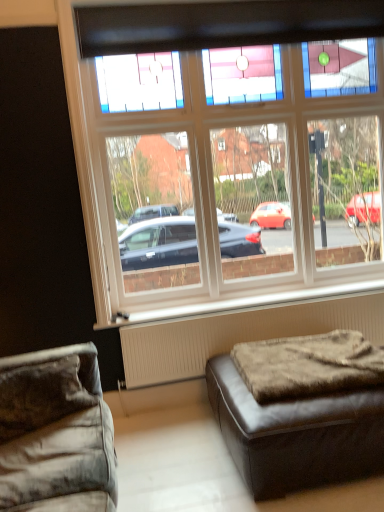
Question: Considering the relative sizes of brown fuzzy ottoman at lower right and brown leather ottoman at lower right, which ranks as the first studio couch in right-to-left order, in the image provided, is brown fuzzy ottoman at lower right smaller than brown leather ottoman at lower right, which ranks as the first studio couch in right-to-left order,?

Choices:
 (A) no
 (B) yes

Answer: (B)

Question: Considering the relative sizes of brown fuzzy ottoman at lower right and brown leather ottoman at lower right, the 2th studio couch in the left-to-right sequence, in the image provided, is brown fuzzy ottoman at lower right wider than brown leather ottoman at lower right, the 2th studio couch in the left-to-right sequence,?

Choices:
 (A) no
 (B) yes

Answer: (A)

Question: Is brown fuzzy ottoman at lower right closer to the viewer compared to brown leather ottoman at lower right, the 2th studio couch in the left-to-right sequence?

Choices:
 (A) no
 (B) yes

Answer: (A)

Question: Is brown fuzzy ottoman at lower right to the left of brown leather ottoman at lower right, which ranks as the first studio couch in right-to-left order, from the viewer's perspective?

Choices:
 (A) yes
 (B) no

Answer: (A)

Question: From a real-world perspective, is brown fuzzy ottoman at lower right on brown leather ottoman at lower right, which ranks as the first studio couch in right-to-left order?

Choices:
 (A) no
 (B) yes

Answer: (B)

Question: Are brown fuzzy ottoman at lower right and brown leather ottoman at lower right, which ranks as the first studio couch in right-to-left order, far apart?

Choices:
 (A) no
 (B) yes

Answer: (A)

Question: From the image's perspective, does white textured radiator at lower right appear lower than brown fuzzy ottoman at lower right?

Choices:
 (A) no
 (B) yes

Answer: (A)

Question: Does white textured radiator at lower right have a lesser width compared to brown fuzzy ottoman at lower right?

Choices:
 (A) no
 (B) yes

Answer: (B)

Question: Considering the relative sizes of white textured radiator at lower right and brown fuzzy ottoman at lower right in the image provided, is white textured radiator at lower right shorter than brown fuzzy ottoman at lower right?

Choices:
 (A) yes
 (B) no

Answer: (B)

Question: Can you confirm if white textured radiator at lower right is positioned to the right of brown fuzzy ottoman at lower right?

Choices:
 (A) no
 (B) yes

Answer: (A)

Question: Is white textured radiator at lower right positioned before brown fuzzy ottoman at lower right?

Choices:
 (A) yes
 (B) no

Answer: (B)

Question: Is white textured radiator at lower right aimed at brown fuzzy ottoman at lower right?

Choices:
 (A) no
 (B) yes

Answer: (B)

Question: Can you confirm if brown fuzzy ottoman at lower right is taller than clear glass window at upper center?

Choices:
 (A) yes
 (B) no

Answer: (B)